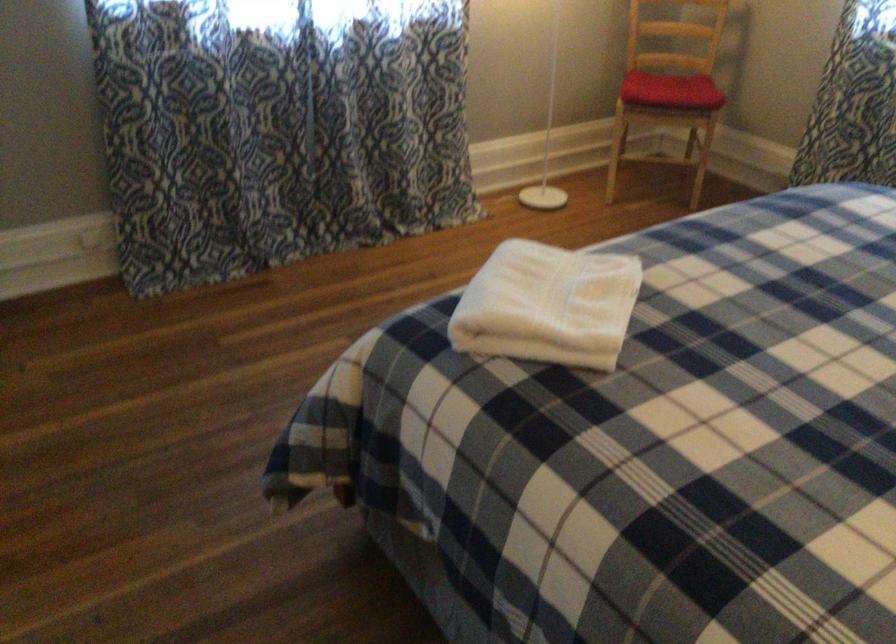
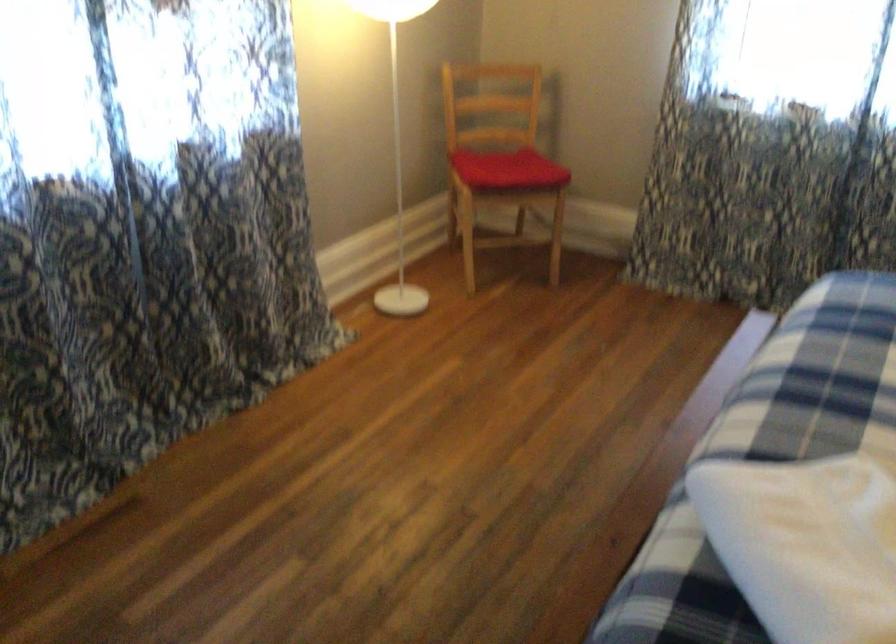
Which direction would the cameraman need to move to produce the second image?

The cameraman moved toward left, forward.